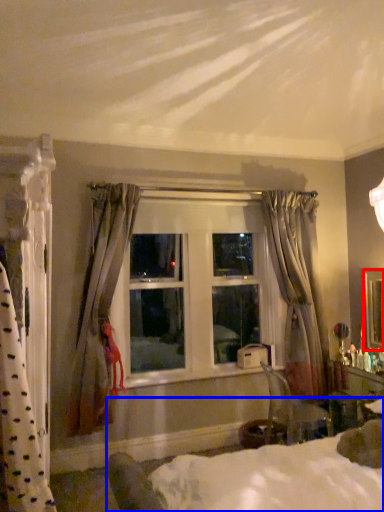
Question: Which of the following is the farthest to the observer, mirror (highlighted by a red box) or bed (highlighted by a blue box)?

Choices:
 (A) mirror
 (B) bed

Answer: (A)